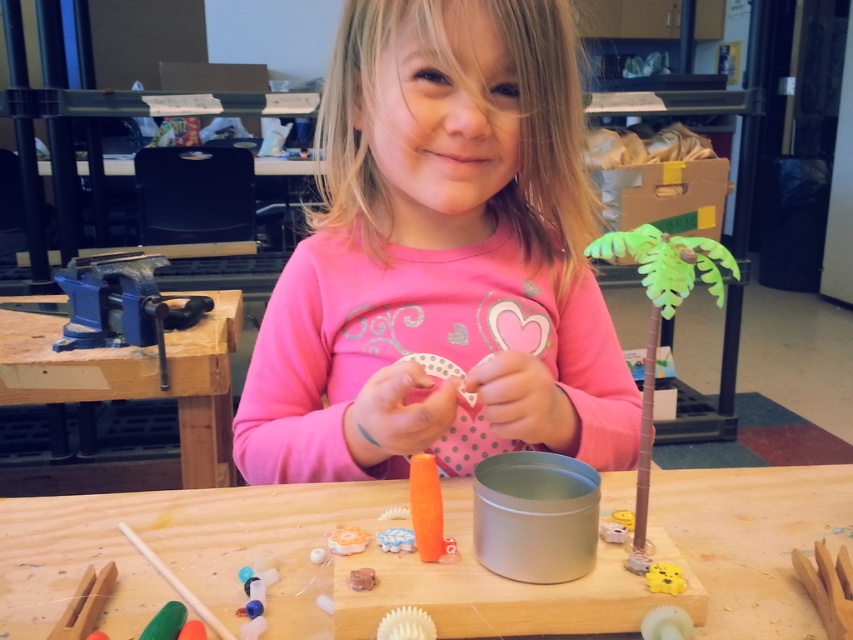
You are a craft instructor observing a student working on a project. The student has a wooden table at center and a wooden stick at lower left. Which object is wider?

The wooden table at center is wider than the wooden stick at lower left because the wooden table at center has a greater width compared to the wooden stick at lower left as stated in the description.

You are a craft instructor observing a student working on a project. The student is using a wooden stick at lower left to work on a wooden table at center. Can you determine which object is taller?

The wooden table at center has a greater height compared to the wooden stick at lower left, so the wooden table at center is taller.